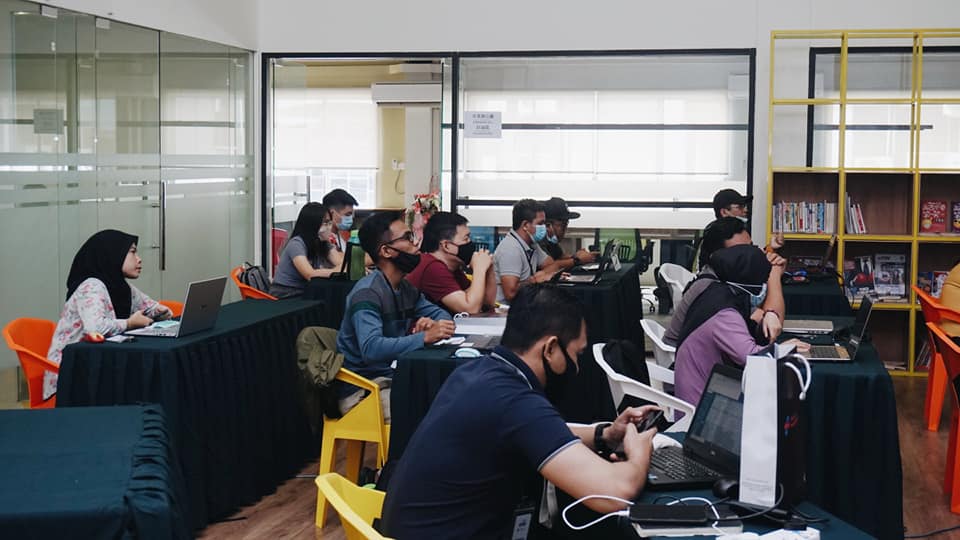
Identify the location of chair. (367, 418), (347, 503), (33, 367), (175, 307), (253, 289), (925, 303), (948, 355).